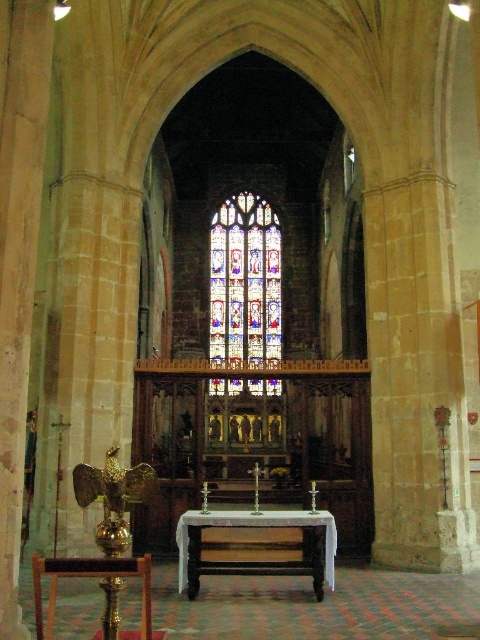
Does stained glass window at center appear over white polished wood altar at center?

Yes.

Image resolution: width=480 pixels, height=640 pixels. In order to click on stained glass window at center in this screenshot , I will do point(244,282).

This screenshot has height=640, width=480. In order to click on stained glass window at center in this screenshot , I will do `click(244, 282)`.